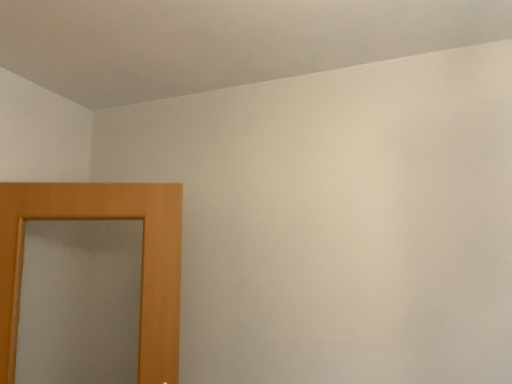
Find the location of a particular element. The height and width of the screenshot is (384, 512). light brown wooden door at lower left is located at coordinates (142, 259).

The image size is (512, 384). Describe the element at coordinates (142, 259) in the screenshot. I see `light brown wooden door at lower left` at that location.

At what (x,y) coordinates should I click in order to perform the action: click on light brown wooden door at lower left. Please return your answer as a coordinate pair (x, y). Looking at the image, I should click on (142, 259).